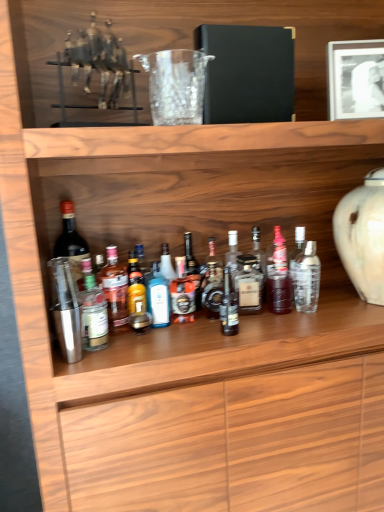
Question: Is white matte picture frame at upper right to the left of metallic silver shaker at center-left, the 2th bottle when ordered from left to right, from the viewer's perspective?

Choices:
 (A) yes
 (B) no

Answer: (B)

Question: Considering the relative sizes of white matte picture frame at upper right and metallic silver shaker at center-left, the 2th bottle when ordered from left to right, in the image provided, is white matte picture frame at upper right shorter than metallic silver shaker at center-left, the 2th bottle when ordered from left to right,?

Choices:
 (A) no
 (B) yes

Answer: (A)

Question: Is white matte picture frame at upper right not close to metallic silver shaker at center-left, positioned as the 12th bottle in right-to-left order?

Choices:
 (A) no
 (B) yes

Answer: (B)

Question: Does white matte picture frame at upper right have a lesser width compared to metallic silver shaker at center-left, the 2th bottle when ordered from left to right?

Choices:
 (A) no
 (B) yes

Answer: (A)

Question: Can you confirm if white matte picture frame at upper right is taller than metallic silver shaker at center-left, positioned as the 12th bottle in right-to-left order?

Choices:
 (A) yes
 (B) no

Answer: (A)

Question: Considering the relative sizes of white matte picture frame at upper right and metallic silver shaker at center-left, the 2th bottle when ordered from left to right, in the image provided, is white matte picture frame at upper right bigger than metallic silver shaker at center-left, the 2th bottle when ordered from left to right,?

Choices:
 (A) no
 (B) yes

Answer: (B)

Question: From a real-world perspective, is matte black bottle at left, placed as the first bottle when sorted from left to right, beneath translucent glass bottle at center, which appears as the 3th bottle when viewed from the left?

Choices:
 (A) no
 (B) yes

Answer: (A)

Question: From the image's perspective, is matte black bottle at left, placed as the first bottle when sorted from left to right, on translucent glass bottle at center, arranged as the 11th bottle when viewed from the right?

Choices:
 (A) no
 (B) yes

Answer: (B)

Question: Is matte black bottle at left, the thirteenth bottle from the right, next to translucent glass bottle at center, which appears as the 3th bottle when viewed from the left, and touching it?

Choices:
 (A) yes
 (B) no

Answer: (B)

Question: Is matte black bottle at left, placed as the first bottle when sorted from left to right, far from translucent glass bottle at center, which appears as the 3th bottle when viewed from the left?

Choices:
 (A) yes
 (B) no

Answer: (B)

Question: Can you confirm if matte black bottle at left, placed as the first bottle when sorted from left to right, is taller than translucent glass bottle at center, which appears as the 3th bottle when viewed from the left?

Choices:
 (A) yes
 (B) no

Answer: (A)

Question: From the image's perspective, is matte black bottle at left, the thirteenth bottle from the right, below translucent glass bottle at center, which appears as the 3th bottle when viewed from the left?

Choices:
 (A) no
 (B) yes

Answer: (A)

Question: Is metallic silver horse at upper left not inside metallic silver shaker at center-left, the 2th bottle when ordered from left to right?

Choices:
 (A) no
 (B) yes

Answer: (B)